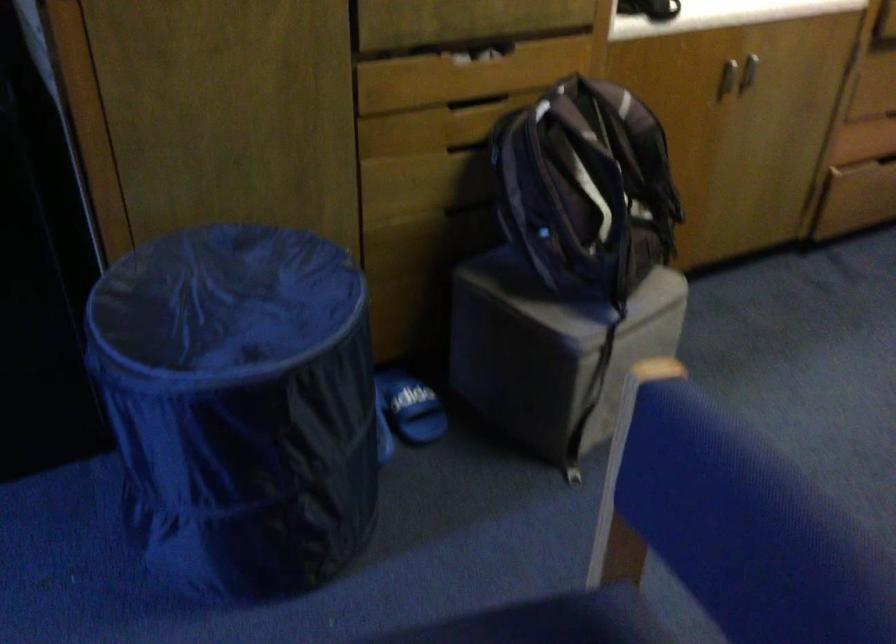
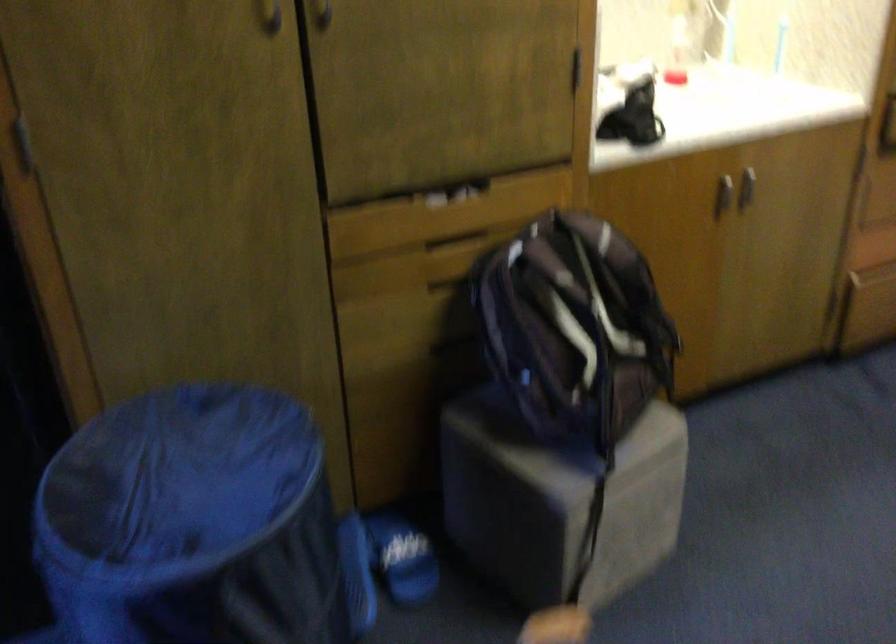
In the second image, find the point that corresponds to (242,341) in the first image.

(193, 523)